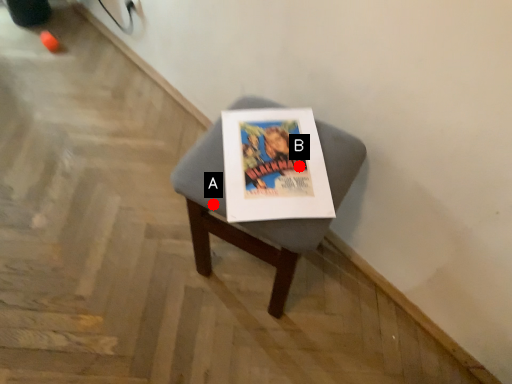
Question: Two points are circled on the image, labeled by A and B beside each circle. Which point is farther to the camera?

Choices:
 (A) A is further
 (B) B is further

Answer: (B)